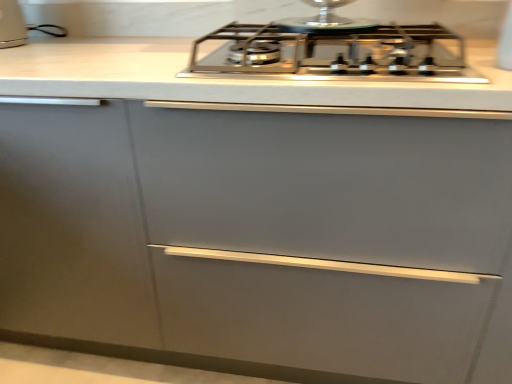
This screenshot has height=384, width=512. What are the coordinates of `white glossy toaster at upper left` in the screenshot? It's located at (12, 25).

What do you see at coordinates (12, 25) in the screenshot?
I see `white glossy toaster at upper left` at bounding box center [12, 25].

What is the approximate width of white glossy toaster at upper left?

7.76 inches.

What is the approximate width of satin silver gas stove at center?

satin silver gas stove at center is 21.82 inches in width.

At what (x,y) coordinates should I click in order to perform the action: click on satin silver gas stove at center. Please return your answer as a coordinate pair (x, y). The image size is (512, 384). Looking at the image, I should click on (335, 54).

Describe the element at coordinates (335, 54) in the screenshot. I see `satin silver gas stove at center` at that location.

Image resolution: width=512 pixels, height=384 pixels. Identify the location of white glossy toaster at upper left. (12, 25).

Considering the relative positions of white glossy toaster at upper left and satin silver gas stove at center in the image provided, is white glossy toaster at upper left to the left of satin silver gas stove at center from the viewer's perspective?

Yes, white glossy toaster at upper left is to the left of satin silver gas stove at center.

Is white glossy toaster at upper left closer to the viewer compared to satin silver gas stove at center?

No, it is not.

Considering the positions of point (23, 20) and point (441, 58), is point (23, 20) closer or farther from the camera than point (441, 58)?

Point (23, 20).

Based on the photo, from the image's perspective, which one is positioned higher, white glossy toaster at upper left or satin silver gas stove at center?

white glossy toaster at upper left is shown above in the image.

From a real-world perspective, is white glossy toaster at upper left below satin silver gas stove at center?

No, from a real-world perspective, white glossy toaster at upper left is not under satin silver gas stove at center.

Considering the relative sizes of white glossy toaster at upper left and satin silver gas stove at center in the image provided, is white glossy toaster at upper left thinner than satin silver gas stove at center?

Yes.

Looking at this image, considering the sizes of white glossy toaster at upper left and satin silver gas stove at center in the image, is white glossy toaster at upper left taller or shorter than satin silver gas stove at center?

white glossy toaster at upper left is taller than satin silver gas stove at center.

Based on the photo, can you confirm if white glossy toaster at upper left is bigger than satin silver gas stove at center?

No, white glossy toaster at upper left is not bigger than satin silver gas stove at center.

Is white glossy toaster at upper left situated inside satin silver gas stove at center or outside?

white glossy toaster at upper left is outside satin silver gas stove at center.

Is white glossy toaster at upper left next to satin silver gas stove at center and touching it?

No.

Is white glossy toaster at upper left oriented towards satin silver gas stove at center?

No, white glossy toaster at upper left is not facing towards satin silver gas stove at center.

The image size is (512, 384). Identify the location of gas stove directly beneath the white glossy toaster at upper left (from a real-world perspective). (335, 54).

Is satin silver gas stove at center to the right of white glossy toaster at upper left from the viewer's perspective?

Yes.

Which object is further away from the camera, satin silver gas stove at center or white glossy toaster at upper left?

white glossy toaster at upper left is further away from the camera.

Is point (408, 65) farther from viewer compared to point (5, 32)?

That is False.

From the image's perspective, is satin silver gas stove at center positioned above or below white glossy toaster at upper left?

Clearly, from the image's perspective, satin silver gas stove at center is below white glossy toaster at upper left.

From a real-world perspective, is satin silver gas stove at center physically above white glossy toaster at upper left?

Actually, satin silver gas stove at center is physically below white glossy toaster at upper left in the real world.

Considering the sizes of satin silver gas stove at center and white glossy toaster at upper left in the image, is satin silver gas stove at center wider or thinner than white glossy toaster at upper left?

In the image, satin silver gas stove at center appears to be wider than white glossy toaster at upper left.

Considering the sizes of satin silver gas stove at center and white glossy toaster at upper left in the image, is satin silver gas stove at center taller or shorter than white glossy toaster at upper left?

Clearly, satin silver gas stove at center is shorter compared to white glossy toaster at upper left.

Consider the image. Can you confirm if satin silver gas stove at center is bigger than white glossy toaster at upper left?

Correct, satin silver gas stove at center is larger in size than white glossy toaster at upper left.

Is satin silver gas stove at center located outside white glossy toaster at upper left?

Absolutely, satin silver gas stove at center is external to white glossy toaster at upper left.

Based on the photo, are satin silver gas stove at center and white glossy toaster at upper left located far from each other?

No, satin silver gas stove at center is not far from white glossy toaster at upper left.

Is satin silver gas stove at center aimed at white glossy toaster at upper left?

No, satin silver gas stove at center is not turned towards white glossy toaster at upper left.

What's the angular difference between satin silver gas stove at center and white glossy toaster at upper left's facing directions?

0.764 degrees separate the facing orientations of satin silver gas stove at center and white glossy toaster at upper left.

I want to click on gas stove in front of the white glossy toaster at upper left, so click(x=335, y=54).

This screenshot has height=384, width=512. I want to click on kitchen appliance above the satin silver gas stove at center (from the image's perspective), so click(12, 25).

I want to click on gas stove on the right side of white glossy toaster at upper left, so click(335, 54).